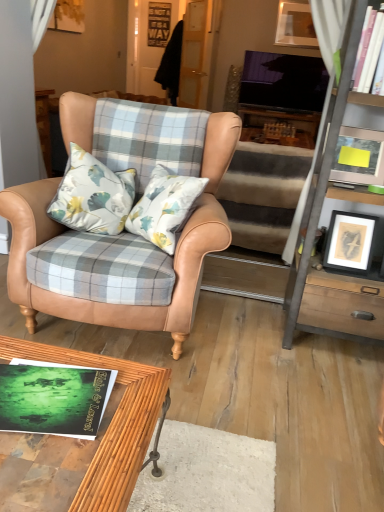
This screenshot has width=384, height=512. In order to click on free space between tan leather chair at center and metallic gray cabinet at right in this screenshot , I will do `click(274, 349)`.